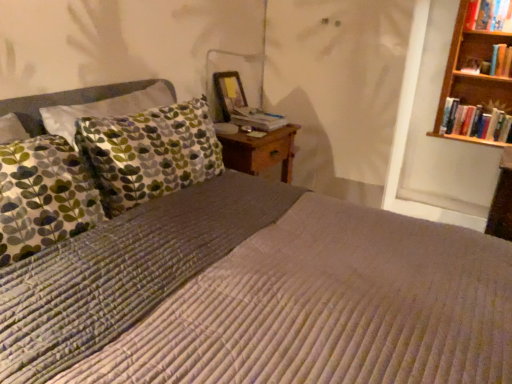
Question: Is hardcover book at upper right, acting as the second book starting from the bottom, further to camera compared to hardcover book at upper right, which is the first book in top-to-bottom order?

Choices:
 (A) no
 (B) yes

Answer: (B)

Question: Does hardcover book at upper right, which ranks as the 2th book in top-to-bottom order, appear on the right side of hardcover book at upper right, which is the first book in top-to-bottom order?

Choices:
 (A) no
 (B) yes

Answer: (B)

Question: From a real-world perspective, is hardcover book at upper right, acting as the second book starting from the bottom, below hardcover book at upper right, which is the first book in top-to-bottom order?

Choices:
 (A) no
 (B) yes

Answer: (B)

Question: Does hardcover book at upper right, which ranks as the 2th book in top-to-bottom order, have a larger size compared to hardcover book at upper right, acting as the third book starting from the bottom?

Choices:
 (A) yes
 (B) no

Answer: (B)

Question: Would you say hardcover book at upper right, acting as the second book starting from the bottom, is outside hardcover book at upper right, which is the first book in top-to-bottom order?

Choices:
 (A) no
 (B) yes

Answer: (B)

Question: In terms of width, does hardcover book at upper right, acting as the third book starting from the bottom, look wider or thinner when compared to hardcover book at center?

Choices:
 (A) thin
 (B) wide

Answer: (A)

Question: Considering the positions of point (482, 23) and point (270, 114), is point (482, 23) closer or farther from the camera than point (270, 114)?

Choices:
 (A) closer
 (B) farther

Answer: (A)

Question: In terms of size, does hardcover book at upper right, acting as the third book starting from the bottom, appear bigger or smaller than hardcover book at center?

Choices:
 (A) big
 (B) small

Answer: (A)

Question: Is hardcover book at upper right, acting as the third book starting from the bottom, inside or outside of hardcover book at center?

Choices:
 (A) inside
 (B) outside

Answer: (B)

Question: Is hardcover book at center bigger or smaller than hardcover book at upper right, which is the first book in top-to-bottom order?

Choices:
 (A) big
 (B) small

Answer: (B)

Question: In terms of width, does hardcover book at center look wider or thinner when compared to hardcover book at upper right, acting as the third book starting from the bottom?

Choices:
 (A) wide
 (B) thin

Answer: (A)

Question: From the image's perspective, is hardcover book at center located above or below hardcover book at upper right, acting as the third book starting from the bottom?

Choices:
 (A) below
 (B) above

Answer: (A)

Question: Considering their positions, is hardcover book at center located in front of or behind hardcover book at upper right, acting as the third book starting from the bottom?

Choices:
 (A) behind
 (B) front

Answer: (B)

Question: From the image's perspective, is hardcover book at center positioned above or below hardcover book at upper right, acting as the second book starting from the bottom?

Choices:
 (A) below
 (B) above

Answer: (A)

Question: Is point [287, 120] positioned closer to the camera than point [495, 52]?

Choices:
 (A) closer
 (B) farther

Answer: (B)